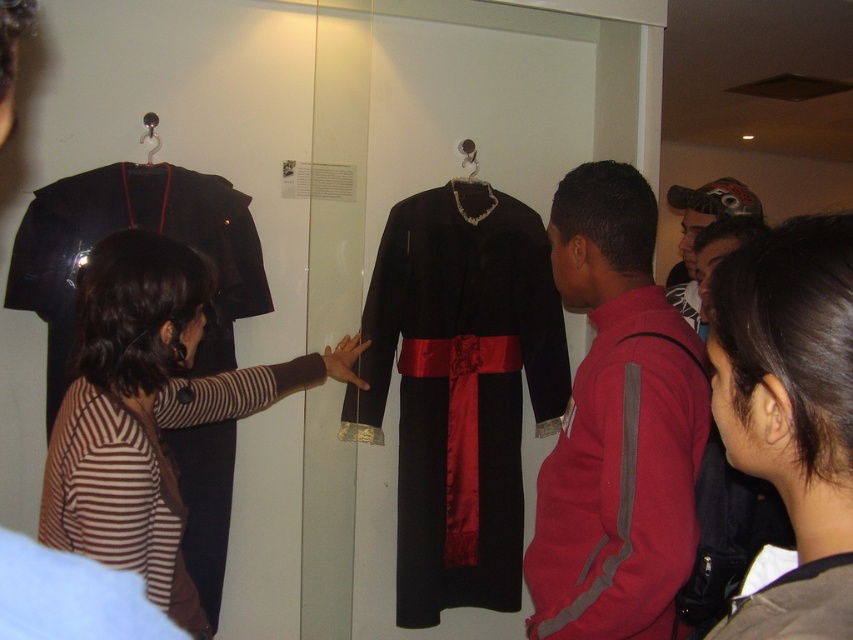
Question: Among these objects, which one is nearest to the camera?

Choices:
 (A) velvet black robe at center
 (B) velvet-like fabric robe at center
 (C) striped fabric shirt at left
 (D) red fleece jacket at center

Answer: (B)

Question: Is dark brown hair at center smaller than matte black jacket at center?

Choices:
 (A) no
 (B) yes

Answer: (B)

Question: Which point appears farthest from the camera in this image?

Choices:
 (A) (582, 269)
 (B) (469, 531)
 (C) (817, 560)
 (D) (718, 220)

Answer: (B)

Question: Is the position of red fleece jacket at center less distant than that of dark brown hair at center?

Choices:
 (A) no
 (B) yes

Answer: (A)

Question: Does velvet black robe at center have a lesser width compared to matte black jacket at center?

Choices:
 (A) no
 (B) yes

Answer: (A)

Question: Which point is farther to the camera?

Choices:
 (A) (199, 332)
 (B) (604, 419)
 (C) (436, 328)

Answer: (C)